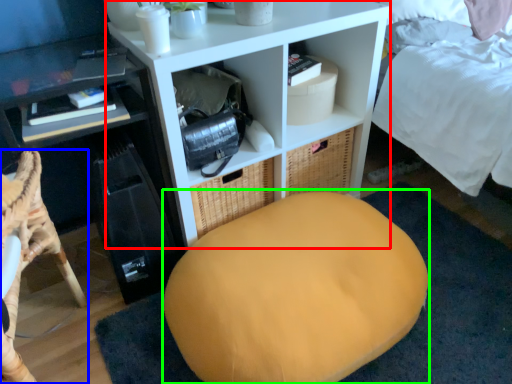
Question: Which object is positioned closest to shelf (highlighted by a red box)? Select from furniture (highlighted by a blue box) and bean bag chair (highlighted by a green box).

Choices:
 (A) furniture
 (B) bean bag chair

Answer: (B)